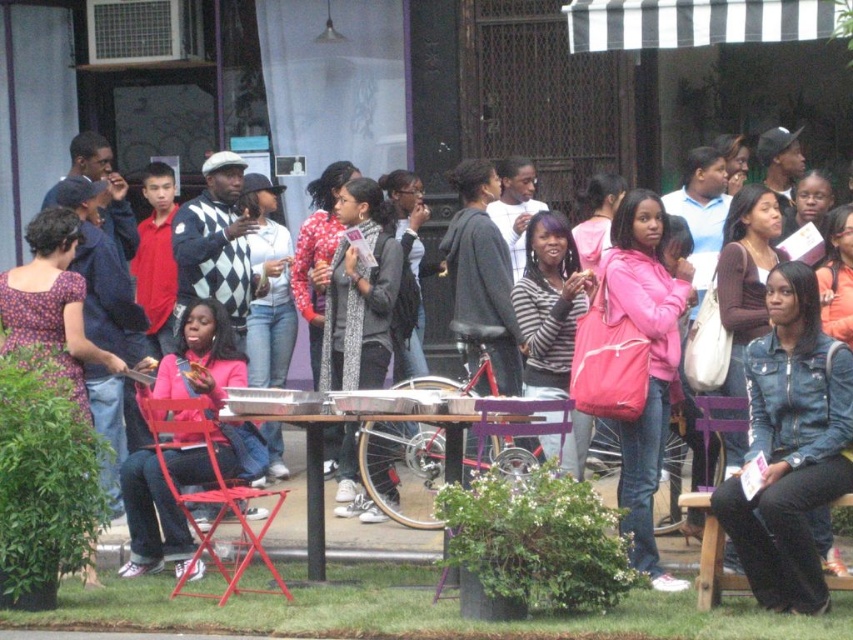
Question: Which object is closer to the camera taking this photo?

Choices:
 (A) purple wood chair at center
 (B) patterned scarf at center
 (C) wooden table at center

Answer: (C)

Question: Does pink fabric backpack at center appear over purple wood chair at center?

Choices:
 (A) yes
 (B) no

Answer: (A)

Question: Which is farther from the patterned scarf at center?

Choices:
 (A) pink fabric backpack at center
 (B) metallic red chair at lower left

Answer: (B)

Question: Is pink fabric backpack at center to the right of wooden table at center from the viewer's perspective?

Choices:
 (A) no
 (B) yes

Answer: (A)

Question: Which is farther from the patterned scarf at center?

Choices:
 (A) wooden table at center
 (B) purple wood chair at center
 (C) pink fabric backpack at center
 (D) metallic red chair at lower left

Answer: (A)

Question: Does patterned scarf at center lie in front of wooden table at center?

Choices:
 (A) no
 (B) yes

Answer: (A)